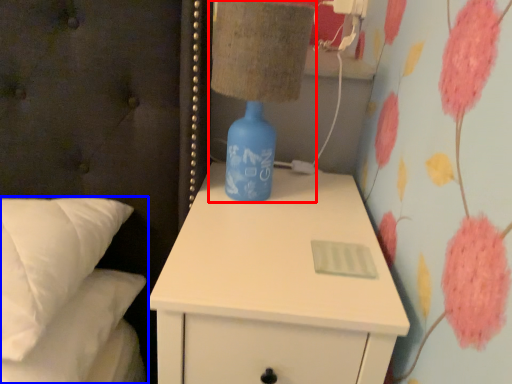
Question: Which object appears closest to the camera in this image, table lamp (highlighted by a red box) or bed (highlighted by a blue box)?

Choices:
 (A) table lamp
 (B) bed

Answer: (B)